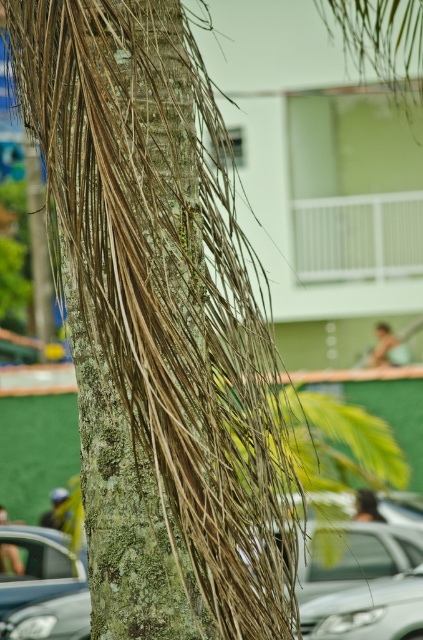
You are standing at the center of the palm tree trunk in the image. You need to locate the metallic silver car at lower left. In which direction should you look to see it?

The metallic silver car at lower left is located at point coordinates that are to the lower left relative to your position at the palm tree trunk center. Therefore, you should look toward the lower left direction to see it.